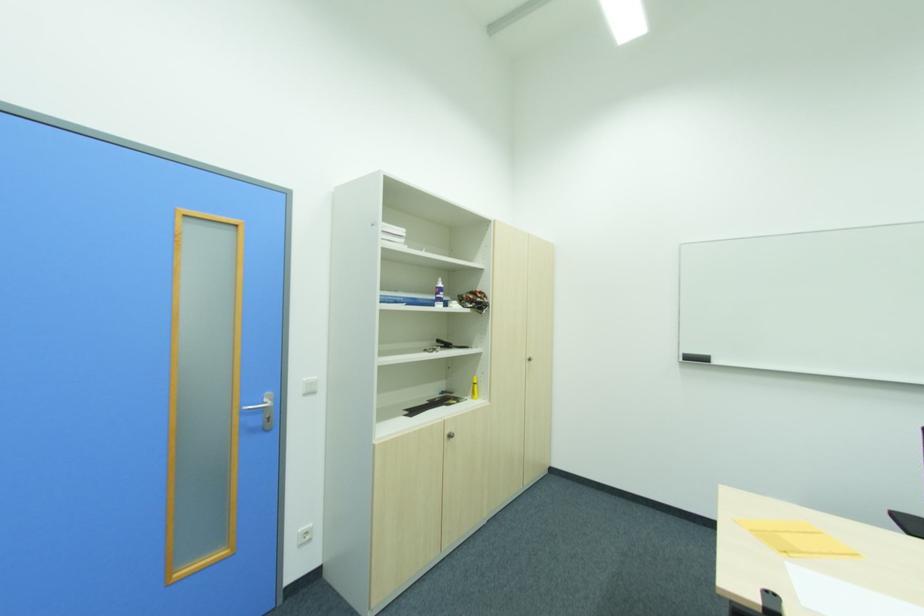
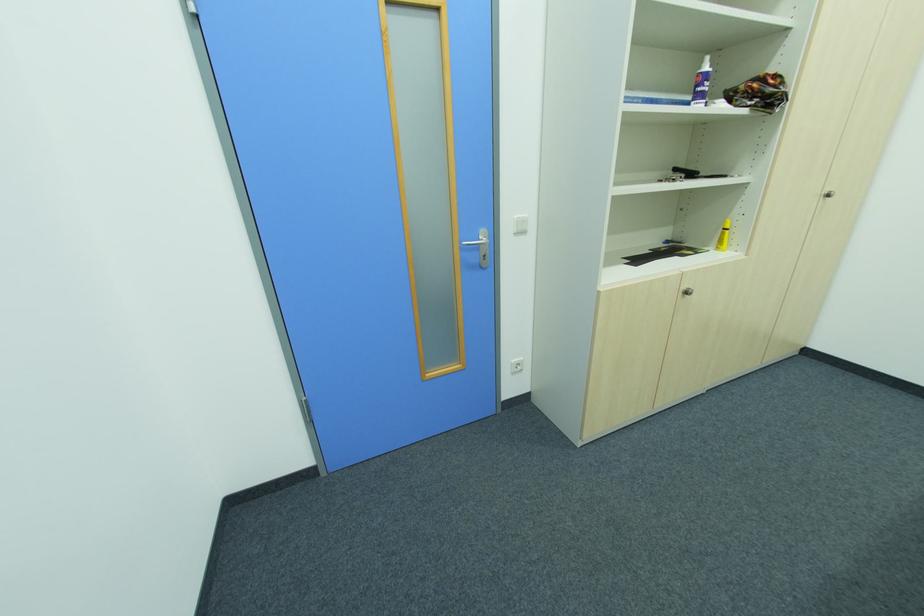
Locate, in the second image, the point that corresponds to point 302,532 in the first image.

(516, 362)